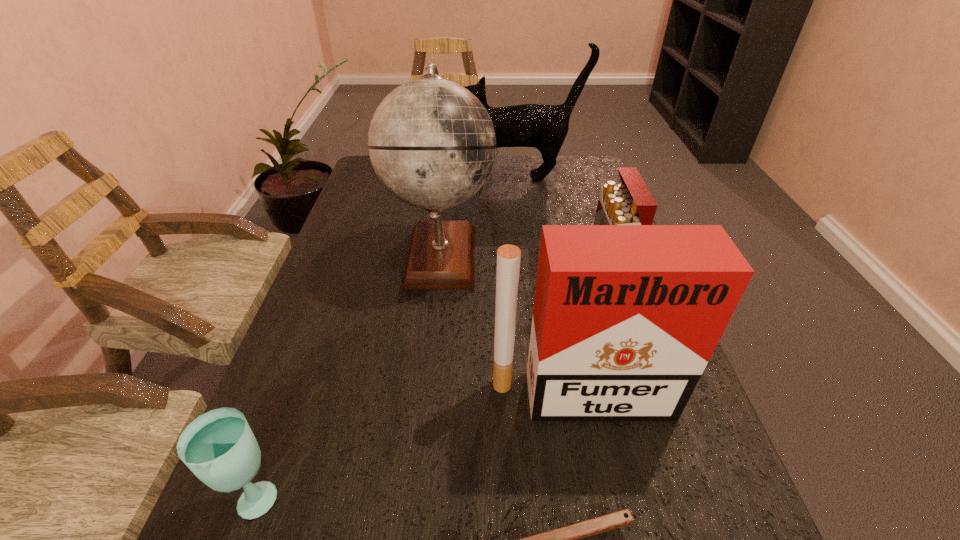
Where is `cat at the right edge`? The height and width of the screenshot is (540, 960). cat at the right edge is located at coordinates (544, 127).

Find the location of `object present at the far right corner`. object present at the far right corner is located at coordinates (544, 127).

What are the coordinates of `free point at the far edge` in the screenshot? It's located at (540, 192).

In the image, there is a desktop. Where is `vacant region at the left edge`? The height and width of the screenshot is (540, 960). vacant region at the left edge is located at coordinates (386, 256).

Where is `vacant region at the right edge of the desktop`? This screenshot has width=960, height=540. vacant region at the right edge of the desktop is located at coordinates (747, 522).

This screenshot has height=540, width=960. Find the location of `free space at the far right corner`. free space at the far right corner is located at coordinates [x=558, y=161].

Locate an element on the screen. The image size is (960, 540). free space between the globe and the glass is located at coordinates (348, 374).

Locate an element on the screen. free area in between the nearer cigarette case and the leftmost object is located at coordinates (419, 445).

What are the coordinates of `empty location between the farther cigarette case and the globe` in the screenshot? It's located at (524, 266).

Where is `empty space between the leftmost object and the cat`? This screenshot has height=540, width=960. empty space between the leftmost object and the cat is located at coordinates coord(387,336).